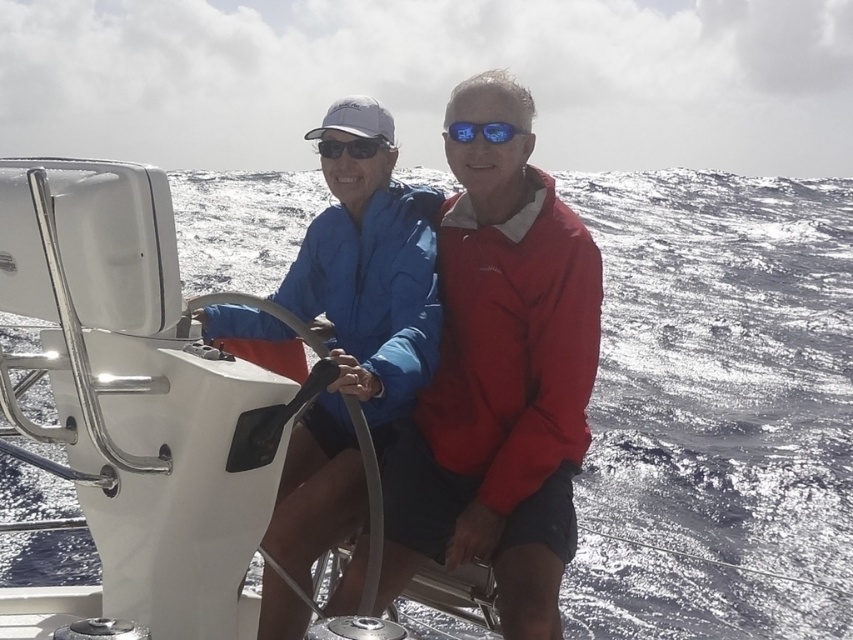
You are a passenger on the boat and want to reach the glistening water at steering wheel left from the blue fabric jacket at center. Which direction should you move in?

The glistening water at steering wheel left is to the right of the blue fabric jacket at center, so you should move to the right to reach it.

You are a passenger on the boat and want to hand a map to the person wearing the blue fabric jacket at center. The map is currently on the control panel above the steering wheel, which is near the matte black sunglasses at center. Can you directly hand the map to the jacket wearer without moving from your seat?

The blue fabric jacket at center is closer to the viewer than the matte black sunglasses at center. Since the map is near the sunglasses, which are farther away, you would need to reach across the distance between them to hand the map directly. However, without moving from your seat, this might be challenging due to the spatial separation between the two objects.